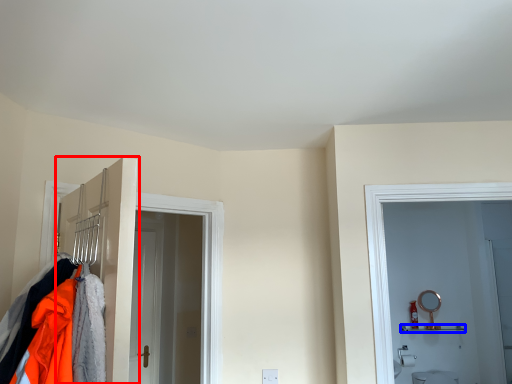
Question: Which point is further to the camera, door (highlighted by a red box) or shelf (highlighted by a blue box)?

Choices:
 (A) door
 (B) shelf

Answer: (B)